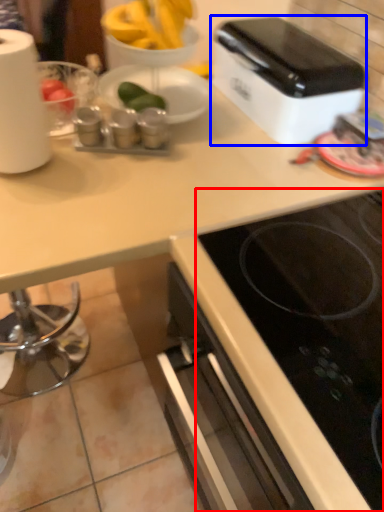
Question: Among these objects, which one is nearest to the camera, gas stove (highlighted by a red box) or toaster (highlighted by a blue box)?

Choices:
 (A) gas stove
 (B) toaster

Answer: (A)